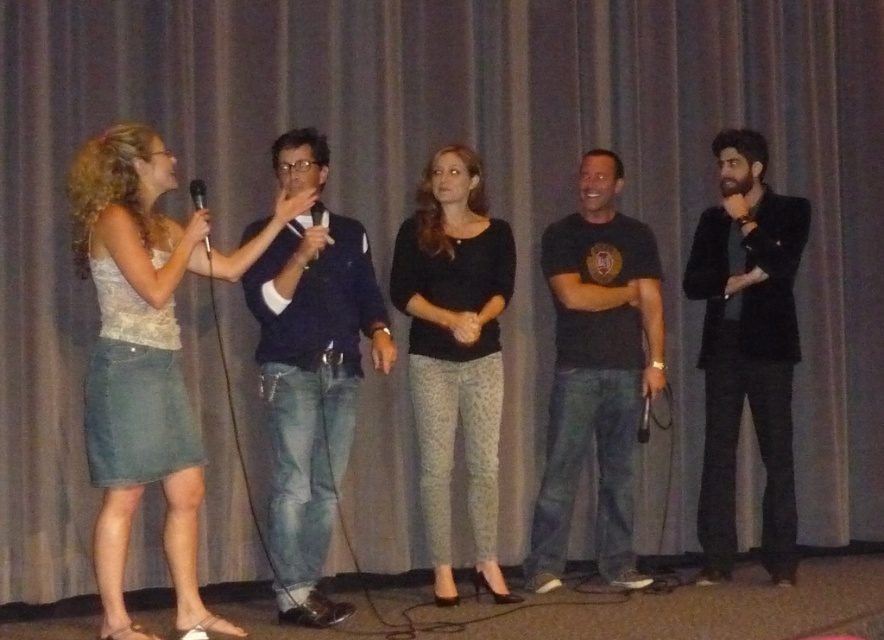
Question: Among these objects, which one is nearest to the camera?

Choices:
 (A) black velvet jacket at right
 (B) black cotton t-shirt at center
 (C) black matte microphone at center

Answer: (C)

Question: Does black matte microphone at upper left appear under black plastic microphone at center?

Choices:
 (A) yes
 (B) no

Answer: (B)

Question: In this image, where is black velvet jacket at right located relative to black matte microphone at center?

Choices:
 (A) left
 (B) right

Answer: (B)

Question: Considering the real-world distances, which object is closest to the denim skirt at left?

Choices:
 (A) black cotton t-shirt at center
 (B) black matte microphone at center
 (C) black velvet jacket at right

Answer: (B)

Question: Which object is the closest to the dark blue denim jeans at center?

Choices:
 (A) black textured sweater at center
 (B) black cotton t-shirt at center
 (C) black plastic microphone at center

Answer: (A)

Question: Is black textured sweater at center closer to the viewer compared to black matte microphone at upper left?

Choices:
 (A) yes
 (B) no

Answer: (B)